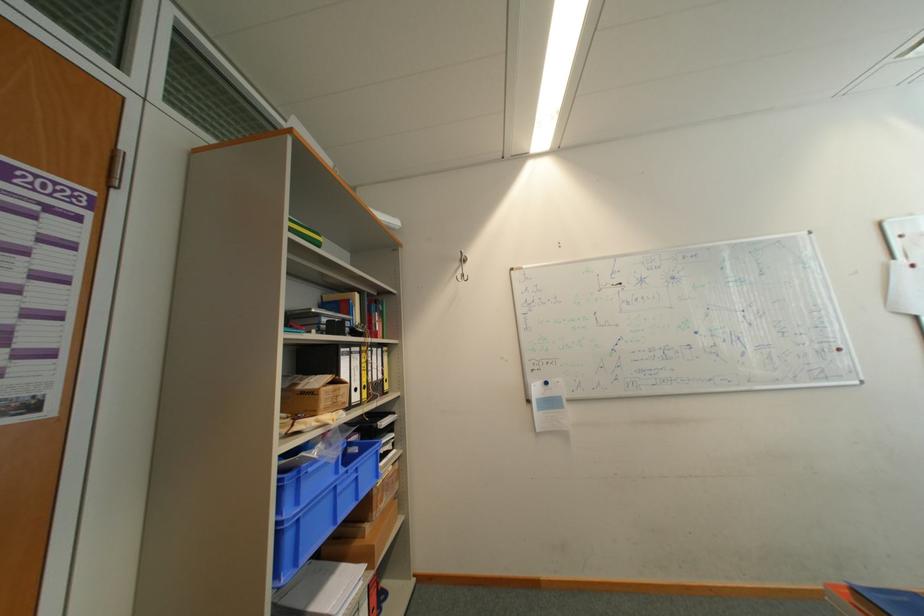
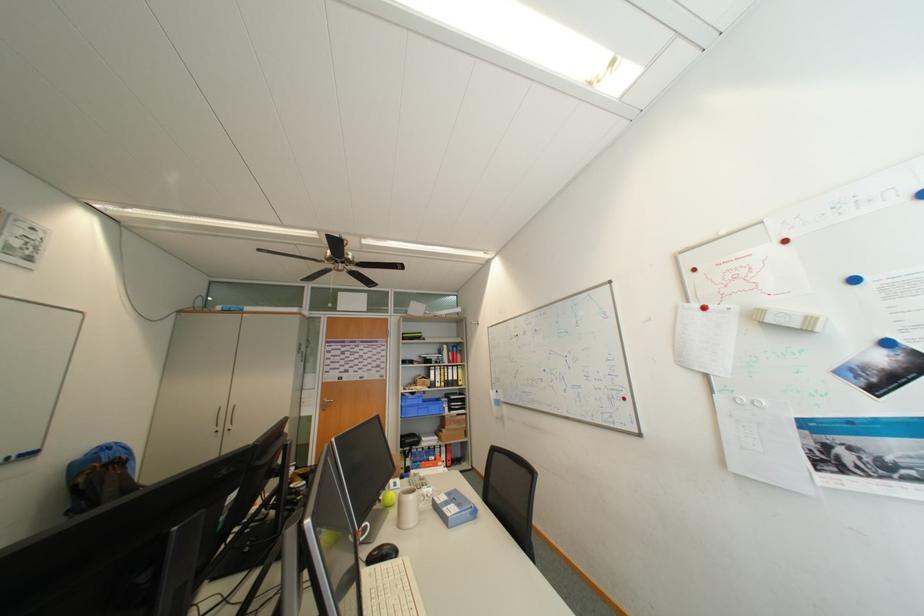
Where in the second image is the point corresponding to the point at 365,399 from the first image?

(447, 386)